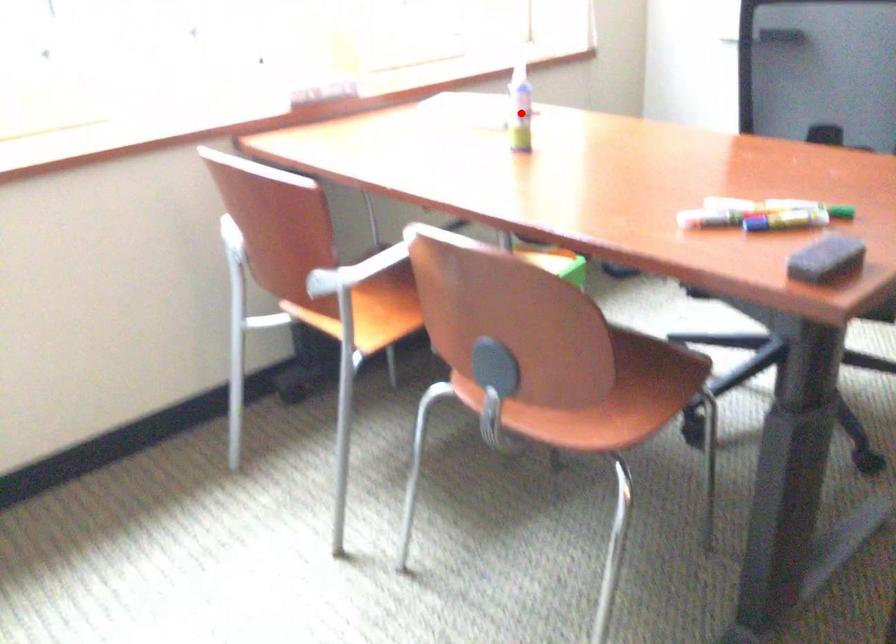
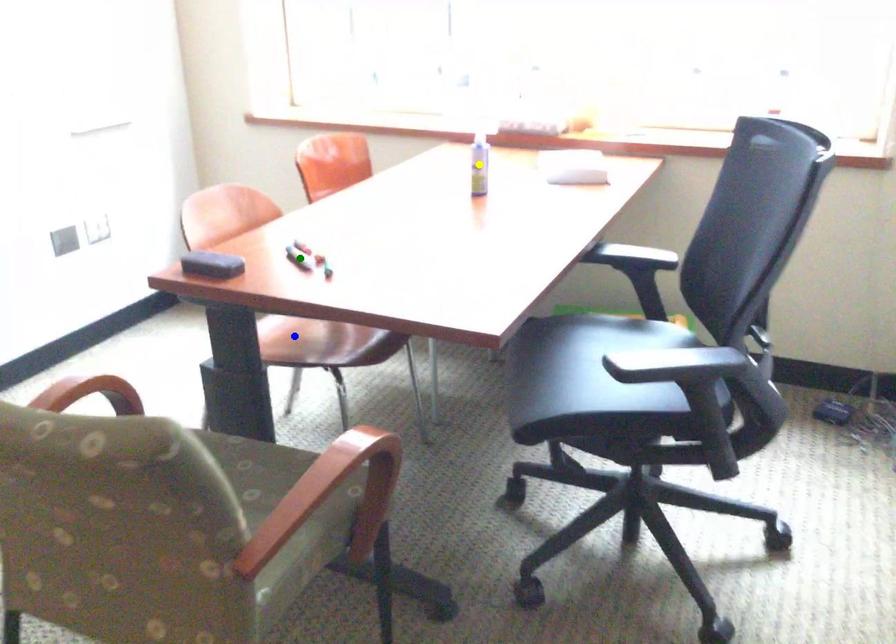
Question: I am providing you with two images of the same scene from different viewpoints. A red point is marked on the first image. You are given multiple points on the second image. Which mark in image 2 goes with the point in image 1?

Choices:
 (A) yellow point
 (B) green point
 (C) blue point

Answer: (A)